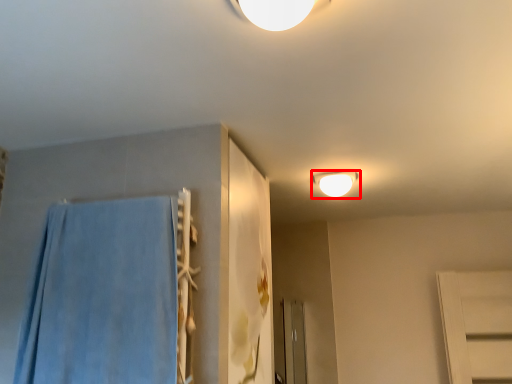
Question: From the image's perspective, what is the correct spatial positioning of lamp (annotated by the red box) in reference to bath towel?

Choices:
 (A) above
 (B) below

Answer: (A)